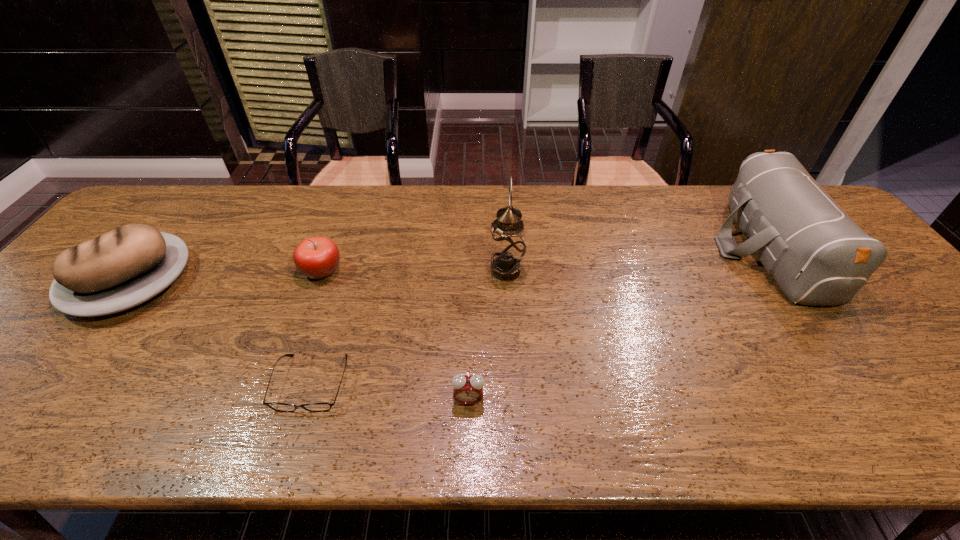
Find the location of a particular element. object present at the far right corner is located at coordinates (817, 254).

Where is `free spot at the far edge of the desktop`? free spot at the far edge of the desktop is located at coordinates (419, 198).

Where is `blank area at the near edge`? The width and height of the screenshot is (960, 540). blank area at the near edge is located at coordinates (600, 407).

In the image, there is a desktop. Where is `vacant area at the right edge`? This screenshot has width=960, height=540. vacant area at the right edge is located at coordinates (874, 326).

You are a GUI agent. You are given a task and a screenshot of the screen. Output one action in this format:
    pyautogui.click(x=<x>, y=<y>)
    Task: Click on the vacant space at the far left corner
    The width and height of the screenshot is (960, 540).
    Given the screenshot: What is the action you would take?
    pyautogui.click(x=156, y=207)

You are a GUI agent. You are given a task and a screenshot of the screen. Output one action in this format:
    pyautogui.click(x=<x>, y=<y>)
    Task: Click on the free point between the third tallest object and the shortest object
    Image resolution: width=960 pixels, height=540 pixels.
    Given the screenshot: What is the action you would take?
    pyautogui.click(x=221, y=332)

Image resolution: width=960 pixels, height=540 pixels. Find the location of `vacant space that's between the rightmost object and the fourth shortest object`. vacant space that's between the rightmost object and the fourth shortest object is located at coordinates (450, 265).

You are a GUI agent. You are given a task and a screenshot of the screen. Output one action in this format:
    pyautogui.click(x=<x>, y=<y>)
    Task: Click on the free space between the duffel bag and the tallest object
    Image resolution: width=960 pixels, height=540 pixels.
    Given the screenshot: What is the action you would take?
    pyautogui.click(x=638, y=260)

The width and height of the screenshot is (960, 540). I want to click on vacant area that lies between the fourth shortest object and the apple, so click(227, 276).

The width and height of the screenshot is (960, 540). Identify the location of unoccupied area between the second shortest object and the spectacles. (390, 392).